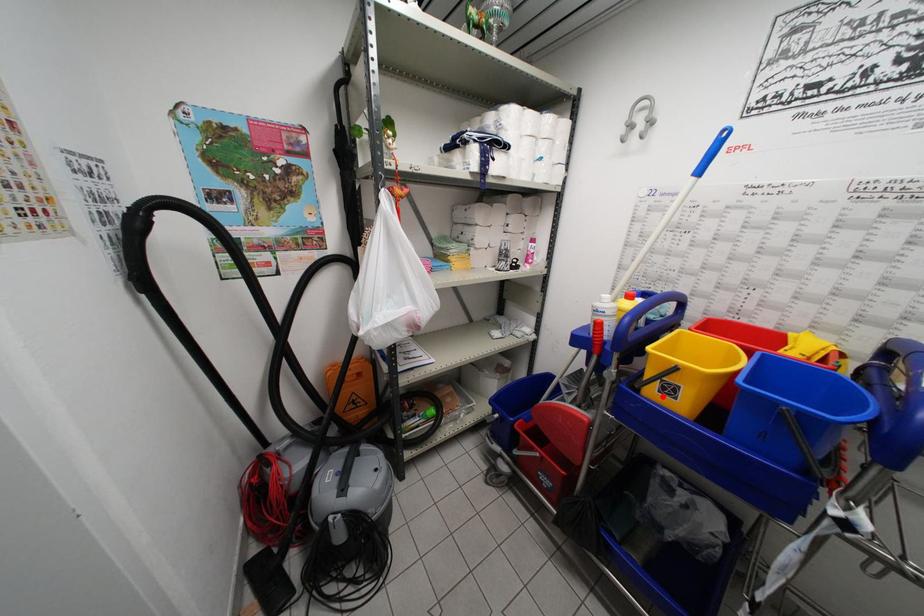
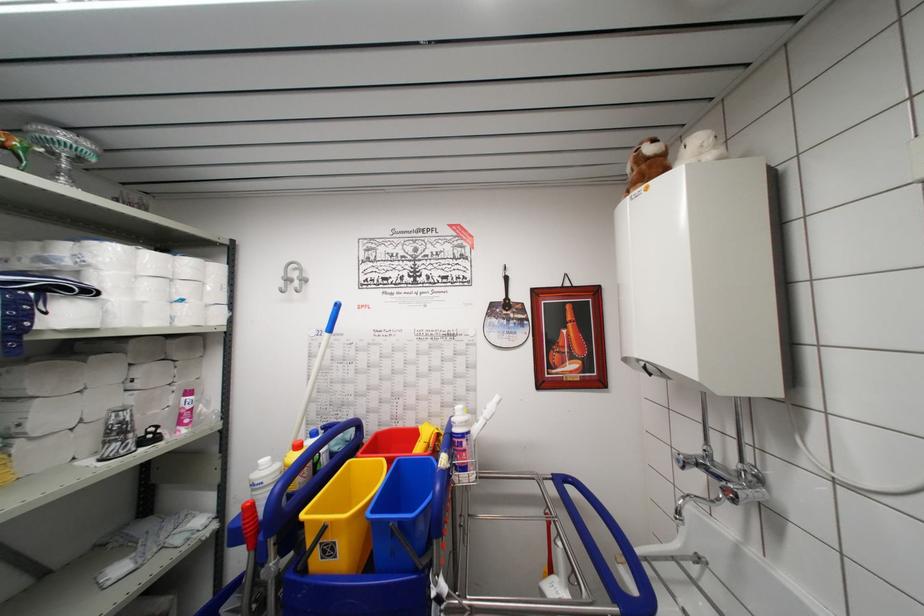
Where in the second image is the point corresponding to the highlighted location from the first image?

(325, 562)